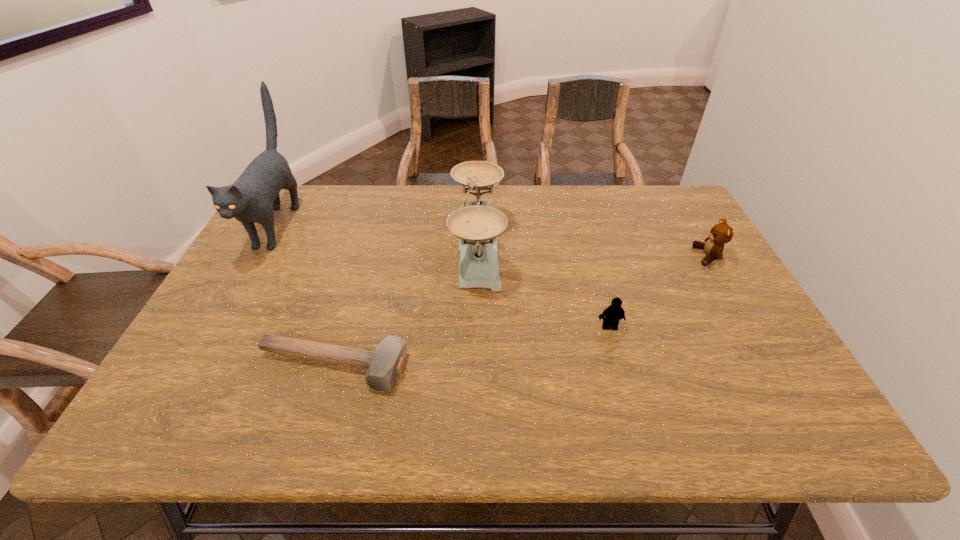
The image size is (960, 540). I want to click on vacant space that's between the teddy bear and the second nearest object, so click(x=659, y=292).

Find the location of a particular element. This screenshot has height=540, width=960. vacant space in between the shortest object and the Lego is located at coordinates (470, 347).

At what (x,y) coordinates should I click in order to perform the action: click on vacant space in between the tallest object and the shortest object. Please return your answer as a coordinate pair (x, y). The image size is (960, 540). Looking at the image, I should click on (304, 296).

You are a GUI agent. You are given a task and a screenshot of the screen. Output one action in this format:
    pyautogui.click(x=<x>, y=<y>)
    Task: Click on the vacant space that is in between the tallest object and the fourth object from right to left
    The width and height of the screenshot is (960, 540).
    Given the screenshot: What is the action you would take?
    pyautogui.click(x=304, y=296)

Identify the location of unoccupied area between the second tallest object and the rightmost object. (592, 252).

Locate an element on the screen. object that is the nearest to the nearest object is located at coordinates (477, 225).

Select which object is the second closest to the tallest object. Please provide its 2D coordinates. Your answer should be formatted as a tuple, i.e. [(x, y)], where the tuple contains the x and y coordinates of a point satisfying the conditions above.

[(477, 225)]

What are the coordinates of `vacant point that satisfies the following two spatial constraints: 1. on the front-facing side of the teddy bear; 2. on the face of the fourth tallest object` in the screenshot? It's located at (749, 327).

You are a GUI agent. You are given a task and a screenshot of the screen. Output one action in this format:
    pyautogui.click(x=<x>, y=<y>)
    Task: Click on the free region that satisfies the following two spatial constraints: 1. at the face of the cat; 2. on the left side of the fourth object from right to left
    The height and width of the screenshot is (540, 960).
    Given the screenshot: What is the action you would take?
    pyautogui.click(x=197, y=367)

Locate an element on the screen. free region that satisfies the following two spatial constraints: 1. on the front-facing side of the teddy bear; 2. on the face of the second object from right to left is located at coordinates (749, 327).